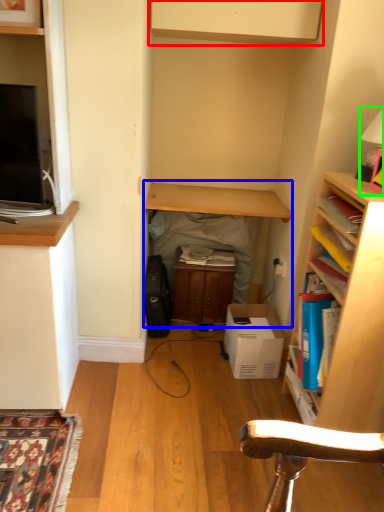
Question: Which object is positioned closest to cabinetry (highlighted by a red box)? Select from table (highlighted by a blue box) and lamp (highlighted by a green box).

Choices:
 (A) table
 (B) lamp

Answer: (B)